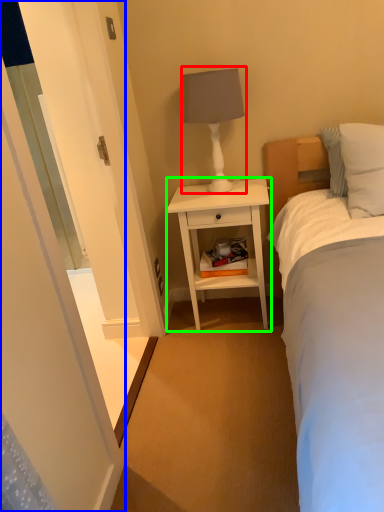
Question: Which object is the farthest from table lamp (highlighted by a red box)? Choose among these: screen door (highlighted by a blue box) or nightstand (highlighted by a green box).

Choices:
 (A) screen door
 (B) nightstand

Answer: (A)